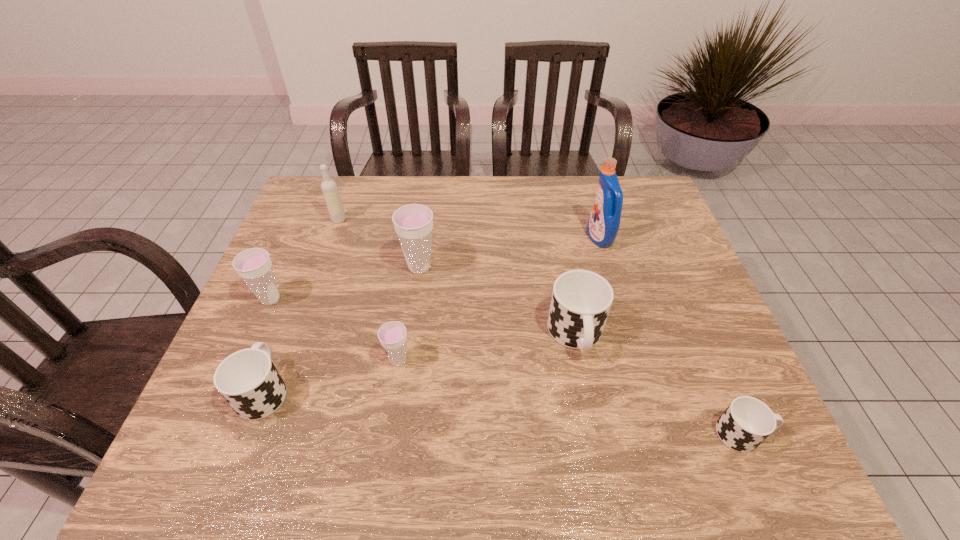
You are a GUI agent. You are given a task and a screenshot of the screen. Output one action in this format:
    pyautogui.click(x=<x>, y=<y>)
    Task: Click on the nearest purple cup
    This screenshot has width=960, height=540.
    Given the screenshot: What is the action you would take?
    pyautogui.click(x=392, y=335)

Locate an element on the screen. This screenshot has width=960, height=540. the leftmost black cup is located at coordinates (248, 380).

This screenshot has width=960, height=540. Find the location of `the rightmost object`. the rightmost object is located at coordinates (747, 422).

Locate an element on the screen. The image size is (960, 540). the shortest cup is located at coordinates (747, 422).

Where is `vacant space located 0.130m on the label of the second object from right to left`? vacant space located 0.130m on the label of the second object from right to left is located at coordinates (544, 238).

At what (x,y) coordinates should I click in order to perform the action: click on free location located 0.220m on the label of the second object from right to left. Please return your answer as a coordinate pair (x, y). Looking at the image, I should click on (515, 238).

The height and width of the screenshot is (540, 960). I want to click on vacant space situated on the label of the second object from right to left, so click(531, 238).

Locate an element on the screen. free region located on the front of the farthest object is located at coordinates (322, 268).

Locate an element on the screen. vacant space situated 0.400m on the front of the farthest cup is located at coordinates (398, 420).

At what (x,y) coordinates should I click in order to perform the action: click on vacant space located on the back of the second farthest purple cup. Please return your answer as a coordinate pair (x, y). The width and height of the screenshot is (960, 540). Looking at the image, I should click on (312, 204).